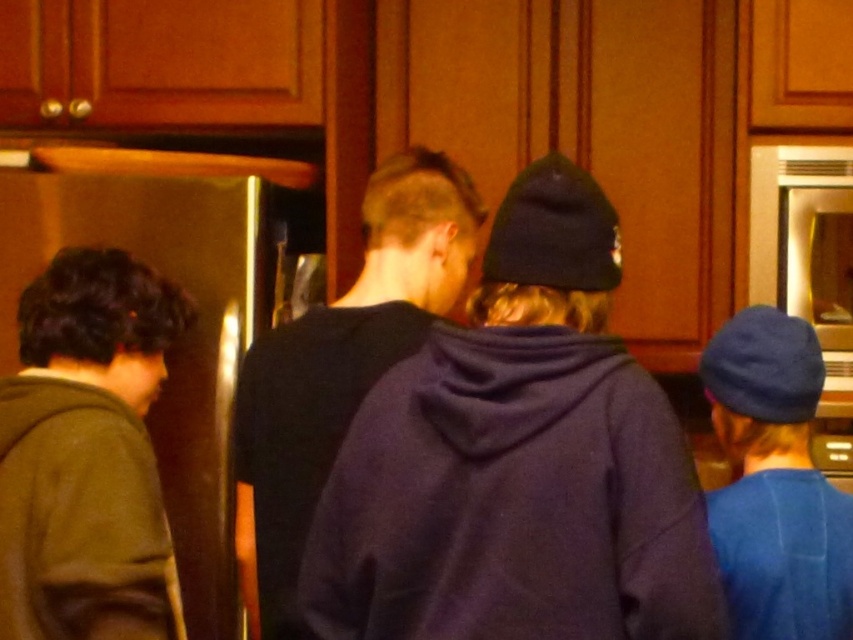
You are standing in the kitchen and notice two items near the counter. One is the green fuzzy sweater at left and the other is the blue woolen cap at right. Which item is higher up compared to the other?

The green fuzzy sweater at left is taller than the blue woolen cap at right.

You are standing in the kitchen and see a point marked at coordinates (518, 461). According to the scene description, what object is located at that point?

The point at coordinates (518, 461) corresponds to the purple fleece hoodie at center.

You are trying to decide which clothing item to take from the kitchen scene for a costume party. Given that the green fuzzy sweater at left and the blue woolen cap at right are both visible, which one would be more suitable for a winter theme based on their sizes?

The green fuzzy sweater at left is larger in size than the blue woolen cap at right, making it more suitable for a winter theme as it can provide better warmth and coverage.